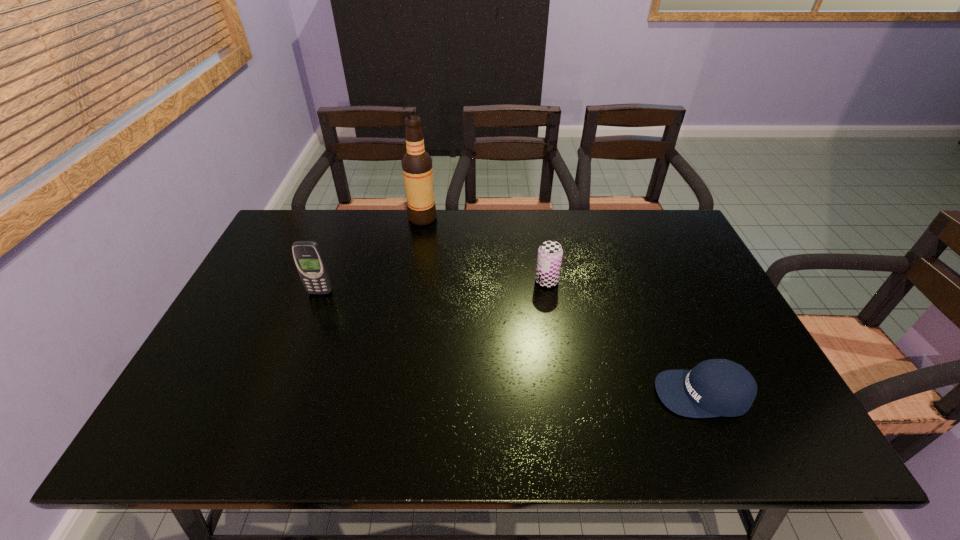
Locate an element on the screen. The width and height of the screenshot is (960, 540). the third object from right to left is located at coordinates (417, 169).

The width and height of the screenshot is (960, 540). In order to click on the tallest object in this screenshot , I will do `click(417, 169)`.

Identify the location of the second nearest object. (308, 257).

Find the location of a particular element. This screenshot has width=960, height=540. the third shortest object is located at coordinates (308, 257).

Locate an element on the screen. The width and height of the screenshot is (960, 540). the third nearest object is located at coordinates (550, 253).

This screenshot has width=960, height=540. What are the coordinates of `beer can` in the screenshot? It's located at (550, 253).

Locate an element on the screen. baseball cap is located at coordinates (717, 387).

At what (x,y) coordinates should I click in order to perform the action: click on the nearest object. Please return your answer as a coordinate pair (x, y). The width and height of the screenshot is (960, 540). Looking at the image, I should click on (717, 387).

The height and width of the screenshot is (540, 960). I want to click on free point located 0.180m on the label of the farthest object, so click(x=491, y=218).

This screenshot has height=540, width=960. What are the coordinates of `vacant space located on the screen of the leftmost object` in the screenshot? It's located at click(278, 399).